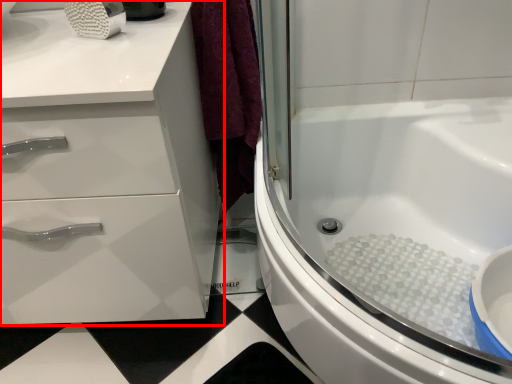
Question: From the image's perspective, what is the correct spatial relationship of bathroom cabinet (annotated by the red box) in relation to bath?

Choices:
 (A) above
 (B) below

Answer: (A)